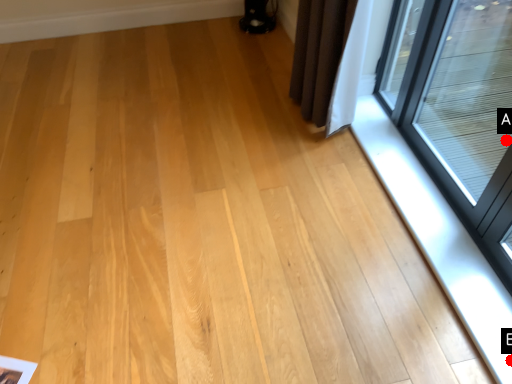
Question: Two points are circled on the image, labeled by A and B beside each circle. Which of the following is the farthest from the observer?

Choices:
 (A) A is further
 (B) B is further

Answer: (A)